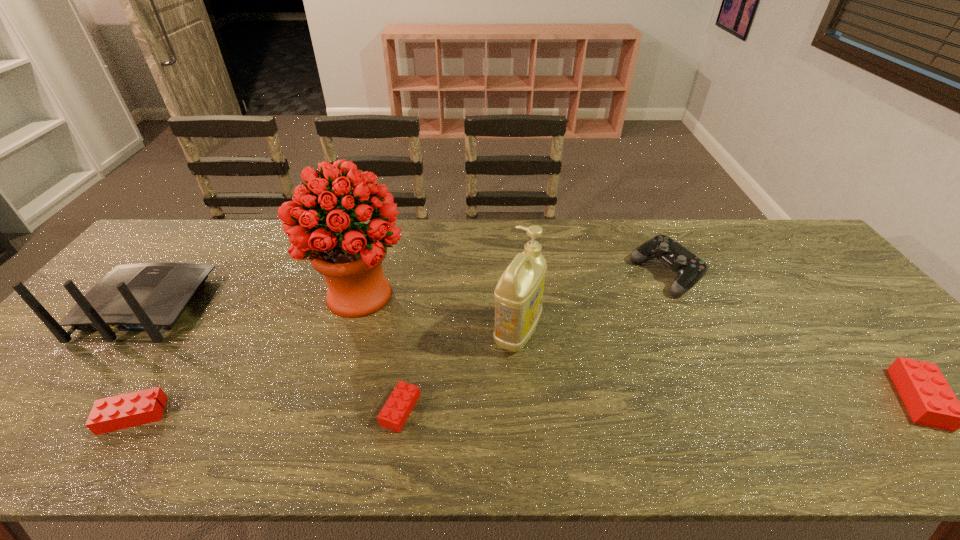
This screenshot has width=960, height=540. I want to click on vacant space at the far edge of the desktop, so click(559, 253).

This screenshot has height=540, width=960. Identify the location of free space at the near edge of the desktop. tap(243, 415).

In order to click on free region at the left edge of the desktop in this screenshot , I will do `click(72, 362)`.

Identify the location of free space at the right edge of the desktop. (859, 321).

I want to click on vacant space at the far left corner of the desktop, so click(167, 227).

In order to click on free space at the far right corner of the desktop in this screenshot , I will do `click(796, 232)`.

Identify the location of free space between the router and the tallest object. Image resolution: width=960 pixels, height=540 pixels. (252, 301).

Locate an element on the screen. unoccupied area between the sixth shortest object and the second object from right to left is located at coordinates (591, 304).

What are the coordinates of `vacant space in between the fifth object from left to right and the router` in the screenshot? It's located at (331, 319).

Find the location of a particular element. free point between the sixth object from left to right and the second Lego from right to left is located at coordinates 533,342.